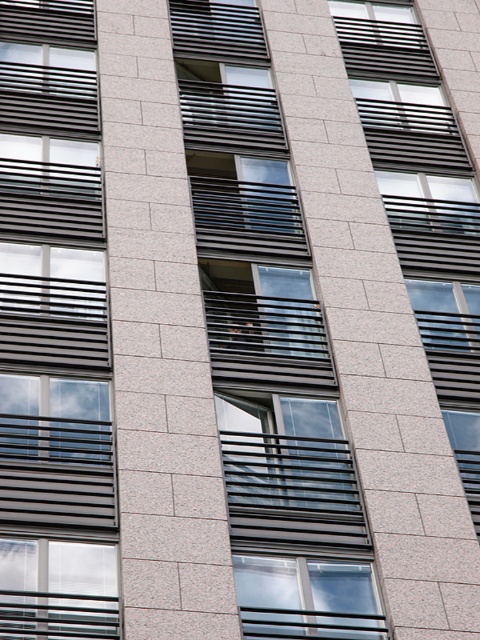
Question: Can you confirm if matte black window at center is wider than clear glass window at center?

Choices:
 (A) no
 (B) yes

Answer: (B)

Question: Considering the relative positions of matte black window at left and clear glass window at center in the image provided, where is matte black window at left located with respect to clear glass window at center?

Choices:
 (A) left
 (B) right

Answer: (A)

Question: Which of the following is the farthest from the observer?

Choices:
 (A) (49, 595)
 (B) (317, 342)
 (C) (244, 588)

Answer: (B)

Question: Which object appears farthest from the camera in this image?

Choices:
 (A) clear glass window at lower left
 (B) matte black window at center
 (C) clear glass window at center

Answer: (C)

Question: Among these objects, which one is farthest from the camera?

Choices:
 (A) matte black window at left
 (B) clear glass window at center
 (C) clear glass window at lower left

Answer: (B)

Question: Is matte black window at center above clear glass window at center?

Choices:
 (A) no
 (B) yes

Answer: (B)